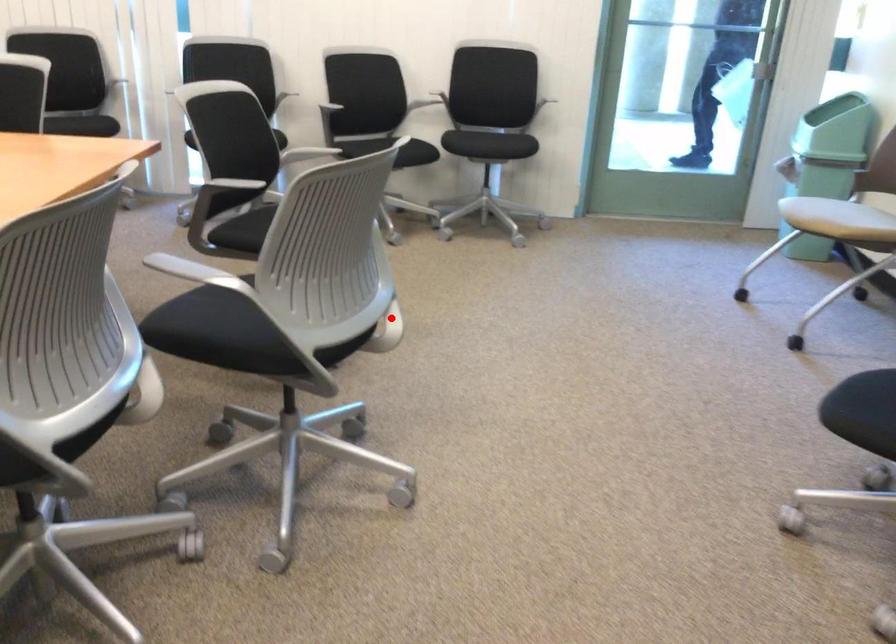
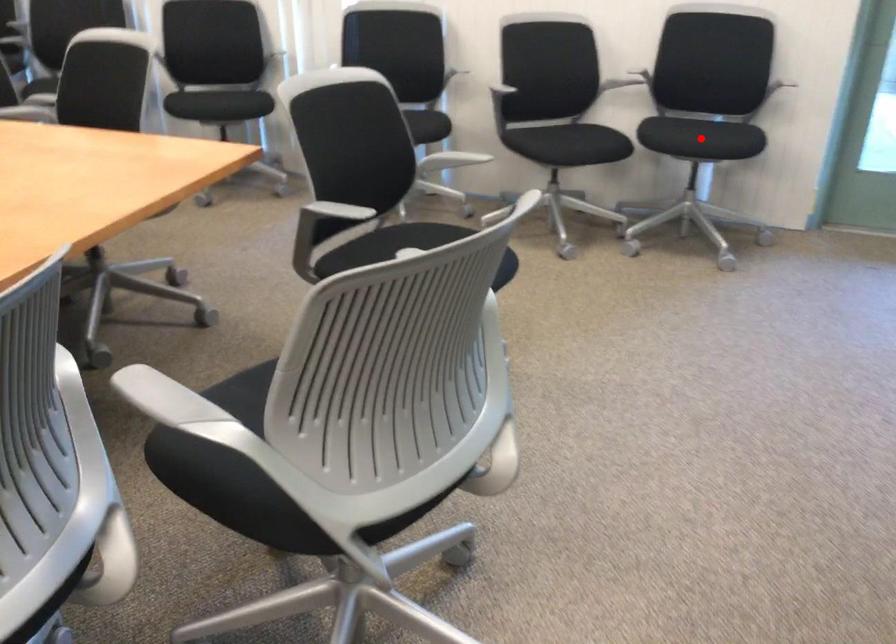
I am providing you with two images of the same scene from different viewpoints. A red point is marked on the first image and another point is marked on the second image. Does the point marked in image1 correspond to the same location as the one in image2?

No